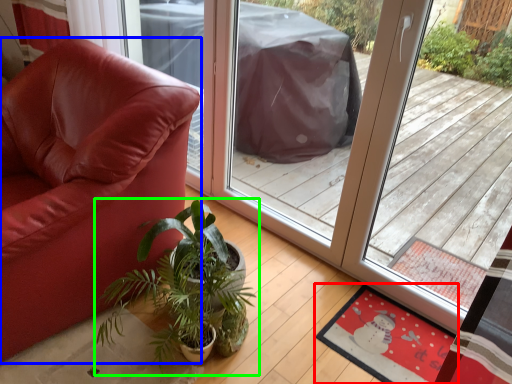
Question: Which object is the closest to the mat (highlighted by a red box)? Choose among these: chair (highlighted by a blue box) or houseplant (highlighted by a green box).

Choices:
 (A) chair
 (B) houseplant

Answer: (B)